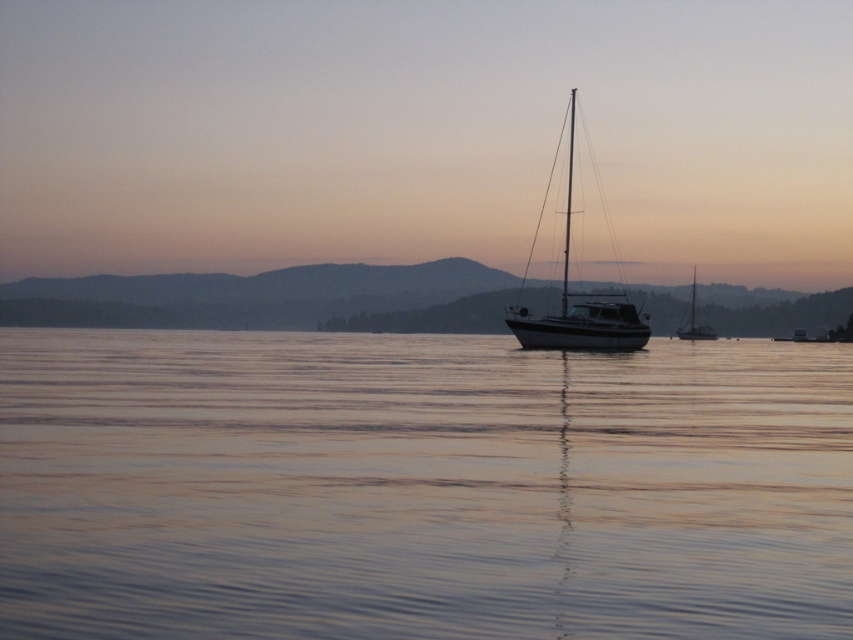
Question: Is smooth water at center positioned at the back of shiny white sailboat at center?

Choices:
 (A) yes
 (B) no

Answer: (B)

Question: Which object is closer to the camera taking this photo?

Choices:
 (A) smooth water at center
 (B) shiny silver sailboat at right
 (C) shiny white sailboat at center

Answer: (A)

Question: Which of the following is the farthest from the observer?

Choices:
 (A) (560, 342)
 (B) (682, 337)

Answer: (B)

Question: Which point is farther to the camera?

Choices:
 (A) smooth water at center
 (B) shiny white sailboat at center

Answer: (B)

Question: Is smooth water at center to the left of shiny silver sailboat at right from the viewer's perspective?

Choices:
 (A) no
 (B) yes

Answer: (B)

Question: Where is shiny white sailboat at center located in relation to shiny silver sailboat at right in the image?

Choices:
 (A) above
 (B) below

Answer: (A)